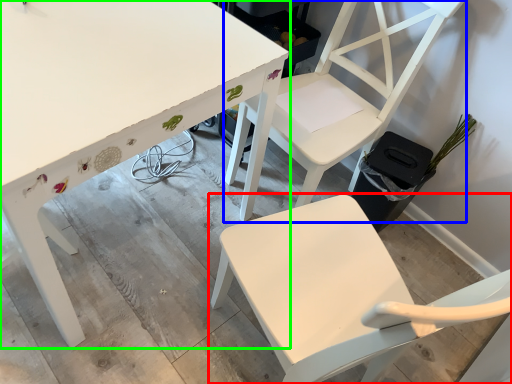
Question: Considering the real-world distances, which object is farthest from chair (highlighted by a red box)? chair (highlighted by a blue box) or table (highlighted by a green box)?

Choices:
 (A) chair
 (B) table

Answer: (B)